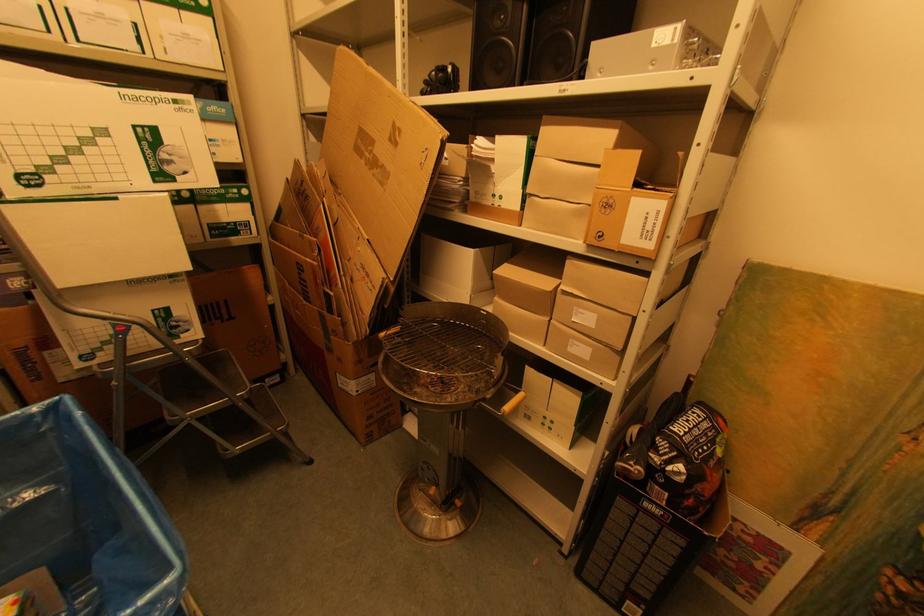
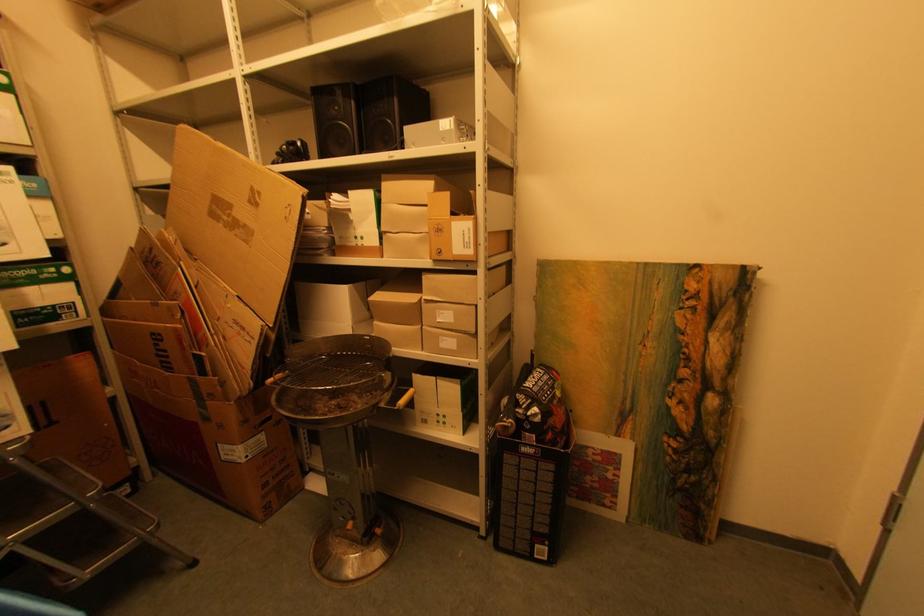
Question: Which direction would the cameraman need to move to produce the second image? Reply with the corresponding letter.

Choices:
 (A) Left
 (B) Right
 (C) Forward
 (D) Backward

Answer: (D)